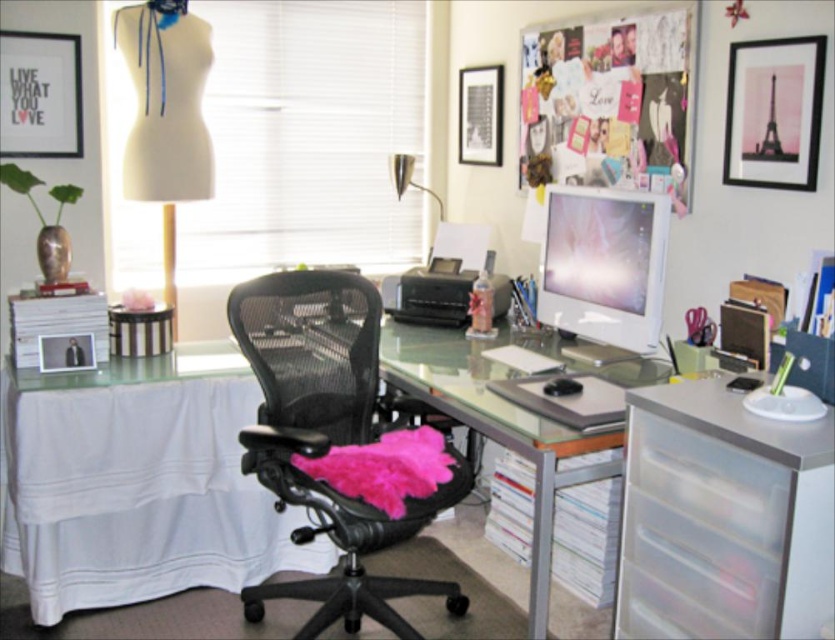
You are organizing your desk and need to place a 25 inch laptop between the clear plastic drawers at right and the white glossy computer monitor at center. Is there enough space between them to fit the laptop?

The clear plastic drawers at right is 24.74 inches from white glossy computer monitor at center. Since the distance is less than 25 inches, the laptop cannot fit between them.

You are setting up a new lamp in the home office. The lamp requires placing its base on a surface that is above the white glossy computer monitor at center. Can you place the lamp base on the clear glass desk at center?

The clear glass desk at center is below the white glossy computer monitor at center, so the lamp base cannot be placed there as it needs to be above the monitor.

You are trying to locate your keys which are on the clear glass desk at center. From the white glossy computer monitor at center, in which direction should you look to find them?

The clear glass desk at center is to the left of the white glossy computer monitor at center, so you should look to the left from the monitor to find the keys.